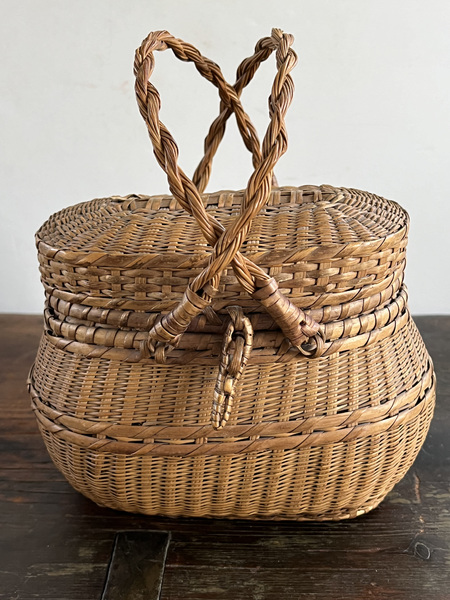
Locate an element on the screen. Image resolution: width=450 pixels, height=600 pixels. brown table surface is located at coordinates pos(416,544), pos(127,562), pos(26,427), pos(432,330).